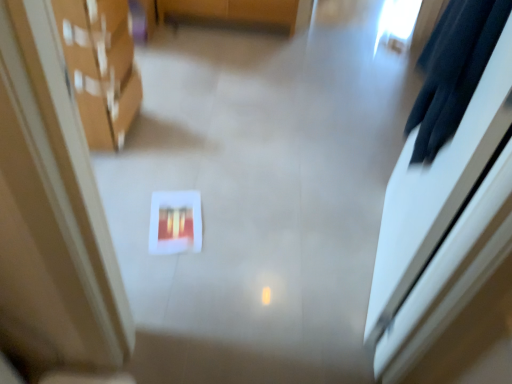
Question: Is matte red book at center oriented away from black fabric robe at upper right?

Choices:
 (A) yes
 (B) no

Answer: (B)

Question: Does matte red book at center have a lesser width compared to black fabric robe at upper right?

Choices:
 (A) no
 (B) yes

Answer: (A)

Question: Does matte red book at center have a greater height compared to black fabric robe at upper right?

Choices:
 (A) no
 (B) yes

Answer: (A)

Question: Can you confirm if matte red book at center is positioned to the left of black fabric robe at upper right?

Choices:
 (A) no
 (B) yes

Answer: (B)

Question: Does matte red book at center lie behind black fabric robe at upper right?

Choices:
 (A) yes
 (B) no

Answer: (A)

Question: Does matte red book at center have a greater width compared to black fabric robe at upper right?

Choices:
 (A) no
 (B) yes

Answer: (B)

Question: Does black fabric robe at upper right lie behind matte cardboard boxes at left?

Choices:
 (A) no
 (B) yes

Answer: (A)

Question: Is black fabric robe at upper right thinner than matte cardboard boxes at left?

Choices:
 (A) no
 (B) yes

Answer: (B)

Question: From the image's perspective, is black fabric robe at upper right beneath matte cardboard boxes at left?

Choices:
 (A) no
 (B) yes

Answer: (B)

Question: Can you confirm if black fabric robe at upper right is positioned to the left of matte cardboard boxes at left?

Choices:
 (A) no
 (B) yes

Answer: (A)

Question: Can you confirm if black fabric robe at upper right is wider than matte cardboard boxes at left?

Choices:
 (A) yes
 (B) no

Answer: (B)

Question: Is black fabric robe at upper right taller than matte cardboard boxes at left?

Choices:
 (A) no
 (B) yes

Answer: (A)

Question: Can you confirm if matte cardboard boxes at left is shorter than matte red book at center?

Choices:
 (A) yes
 (B) no

Answer: (B)